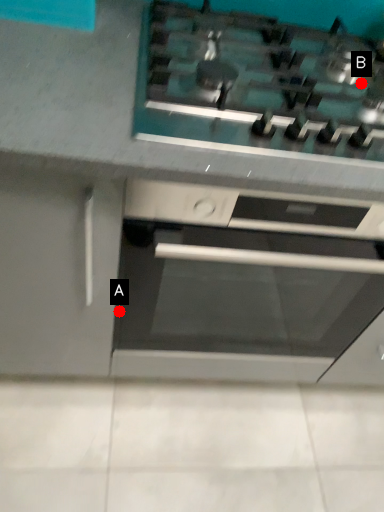
Question: Two points are circled on the image, labeled by A and B beside each circle. Which point is further to the camera?

Choices:
 (A) A is further
 (B) B is further

Answer: (A)